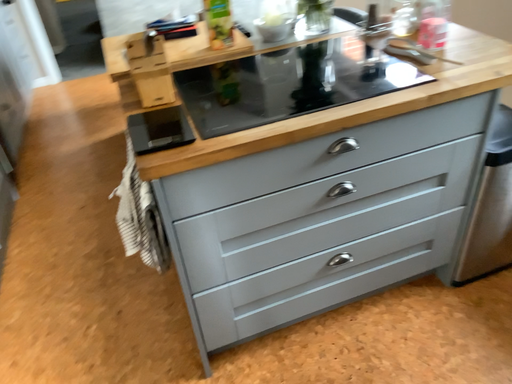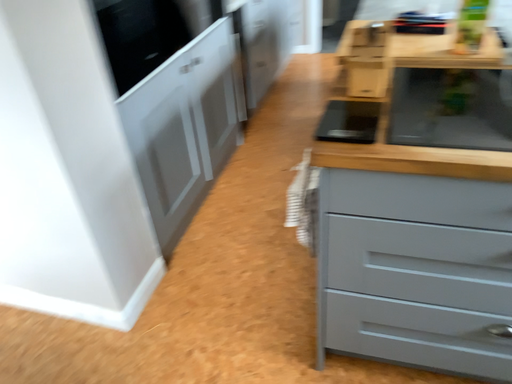
Question: Which way did the camera rotate in the video?

Choices:
 (A) rotated left
 (B) rotated right

Answer: (A)